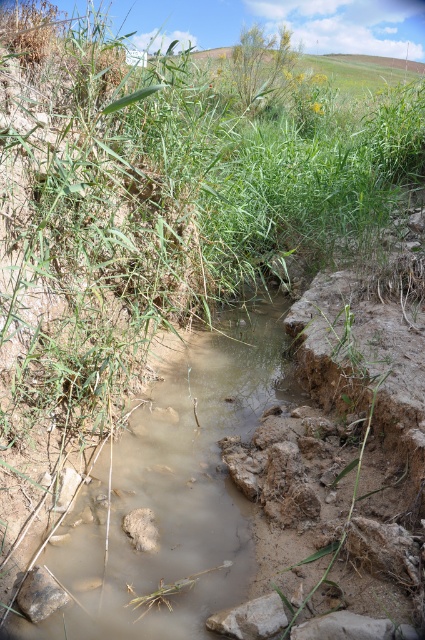
Question: Which point is farther to the camera?

Choices:
 (A) muddy water at center
 (B) gray rough rock at lower center

Answer: (A)

Question: Is muddy water at center smaller than gray rough rock at lower center?

Choices:
 (A) no
 (B) yes

Answer: (A)

Question: Does muddy water at center have a lesser width compared to gray rough rock at lower center?

Choices:
 (A) no
 (B) yes

Answer: (A)

Question: Which object is farther from the camera taking this photo?

Choices:
 (A) gray rough rock at lower center
 (B) muddy water at center

Answer: (B)

Question: Where is muddy water at center located in relation to gray rough rock at lower center in the image?

Choices:
 (A) right
 (B) left

Answer: (B)